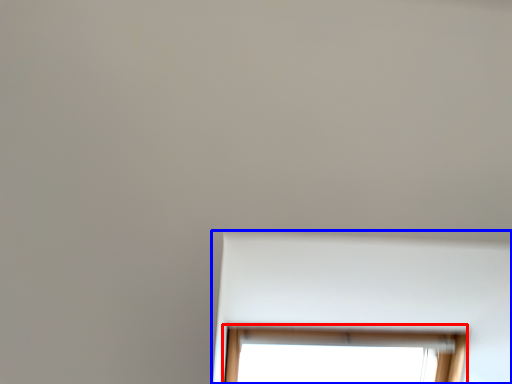
Question: Which of the following is the closest to the observer, window (highlighted by a red box) or bay window (highlighted by a blue box)?

Choices:
 (A) window
 (B) bay window

Answer: (B)